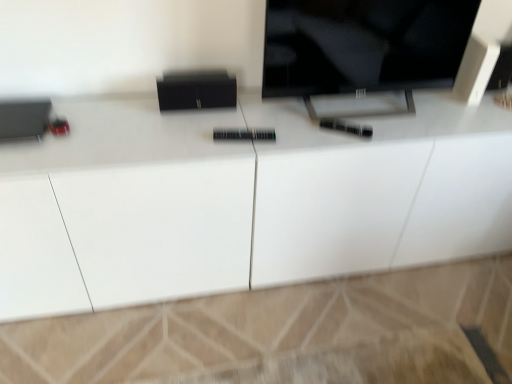
Question: From a real-world perspective, is black glossy tv at upper center positioned above or below white glossy cabinet at center?

Choices:
 (A) below
 (B) above

Answer: (B)

Question: Looking at the image, does black glossy tv at upper center seem bigger or smaller compared to white glossy cabinet at center?

Choices:
 (A) big
 (B) small

Answer: (B)

Question: In terms of height, does black glossy tv at upper center look taller or shorter compared to white glossy cabinet at center?

Choices:
 (A) short
 (B) tall

Answer: (A)

Question: Looking at the image, does white glossy cabinet at center seem bigger or smaller compared to black glossy tv at upper center?

Choices:
 (A) big
 (B) small

Answer: (A)

Question: From the image's perspective, is white glossy cabinet at center positioned above or below black glossy tv at upper center?

Choices:
 (A) below
 (B) above

Answer: (A)

Question: In the image, is white glossy cabinet at center positioned in front of or behind black glossy tv at upper center?

Choices:
 (A) front
 (B) behind

Answer: (A)

Question: Choose the correct answer: Is white glossy cabinet at center inside black glossy tv at upper center or outside it?

Choices:
 (A) outside
 (B) inside

Answer: (A)